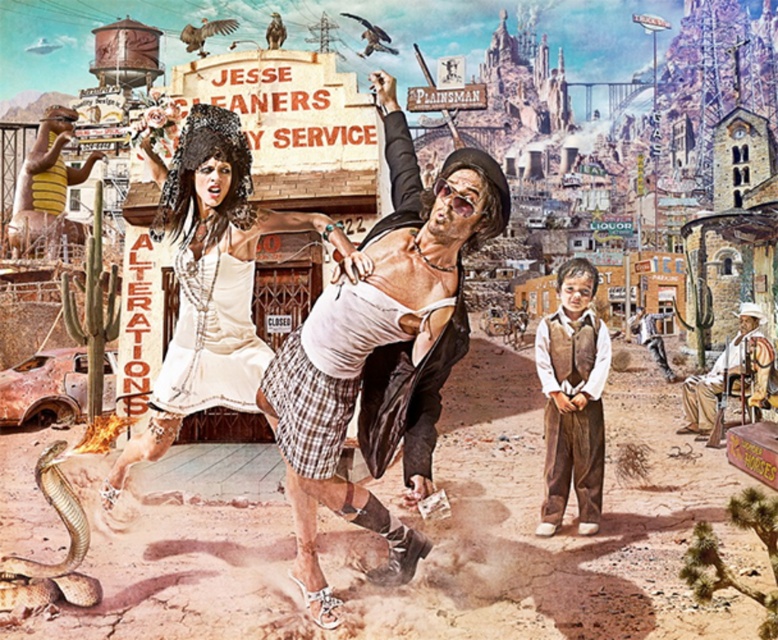
Question: In this image, where is leather jacket at center located relative to rustic wooden chair at lower right?

Choices:
 (A) below
 (B) above

Answer: (B)

Question: Estimate the real-world distances between objects in this image. Which object is farther from the yellow striped shirt at left?

Choices:
 (A) brown cotton vest at lower right
 (B) white lace dress at center
 (C) shiny brown snake at lower left
 (D) leather jacket at center

Answer: (C)

Question: Among these points, which one is nearest to the camera?

Choices:
 (A) (342, 262)
 (B) (731, 365)
 (C) (573, 298)
 (D) (13, 586)

Answer: (D)

Question: Can you confirm if white lace dress at center is wider than yellow striped shirt at left?

Choices:
 (A) no
 (B) yes

Answer: (A)

Question: Which object appears closest to the camera in this image?

Choices:
 (A) brown cotton vest at lower right
 (B) white lace dress at center
 (C) leather jacket at center
 (D) rustic wooden chair at lower right

Answer: (C)

Question: Is white lace dress at center positioned before rustic wooden chair at lower right?

Choices:
 (A) yes
 (B) no

Answer: (A)